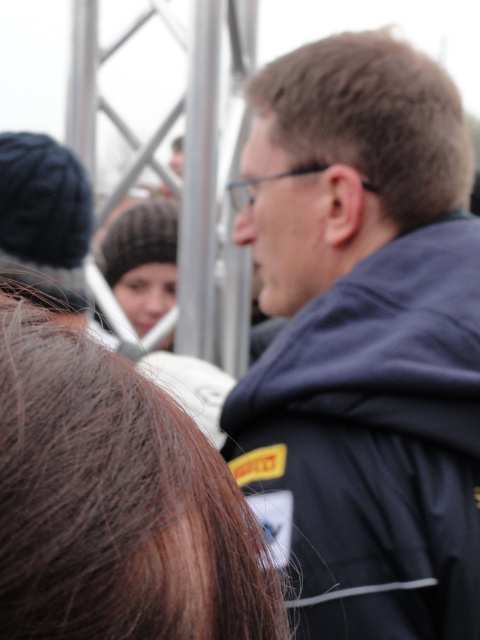
You are a photographer adjusting your camera to focus on the knitted woolen hat at center. However, the dark blue jacket at upper right is blocking your view. Can you shift your position to the left to avoid the jacket and still keep the hat in the frame?

The dark blue jacket at upper right is in front of the knitted woolen hat at center, so shifting to the left might allow you to see around the jacket and still keep the hat in view.